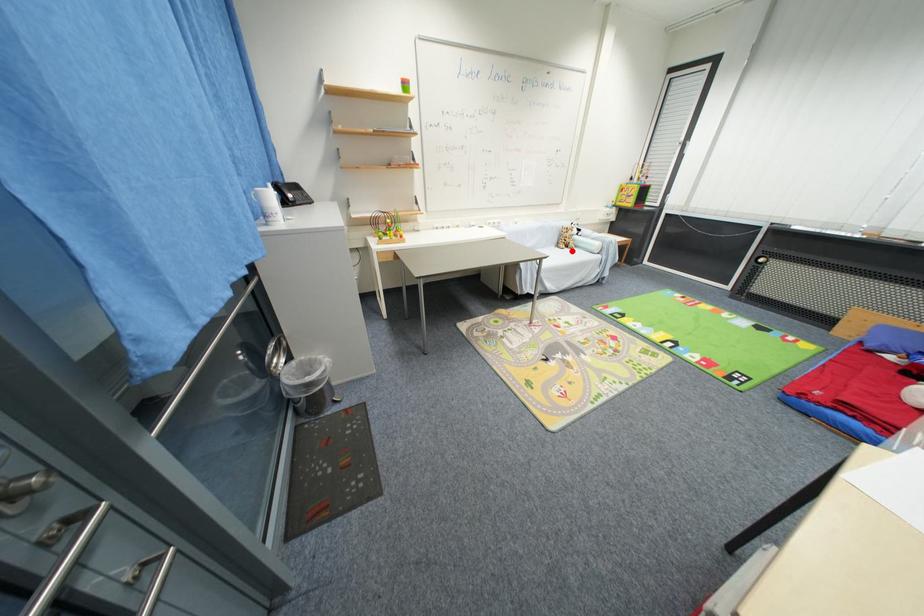
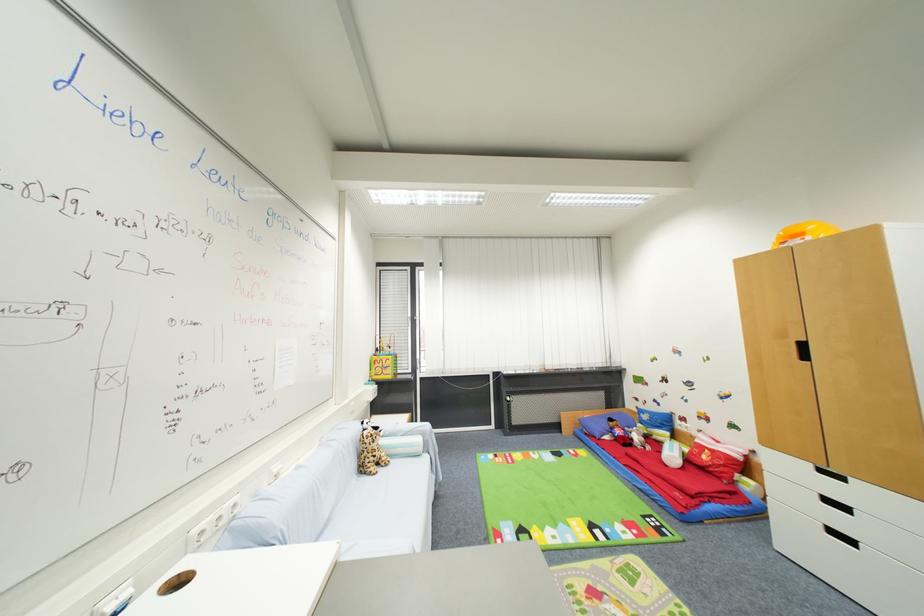
The point at the highlighted location is marked in the first image. Where is the corresponding point in the second image?

(385, 472)